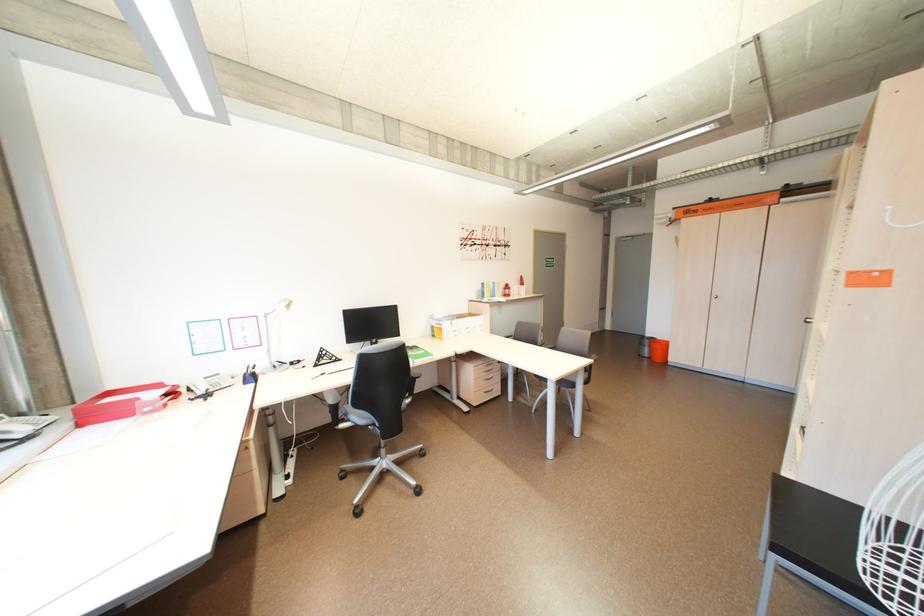
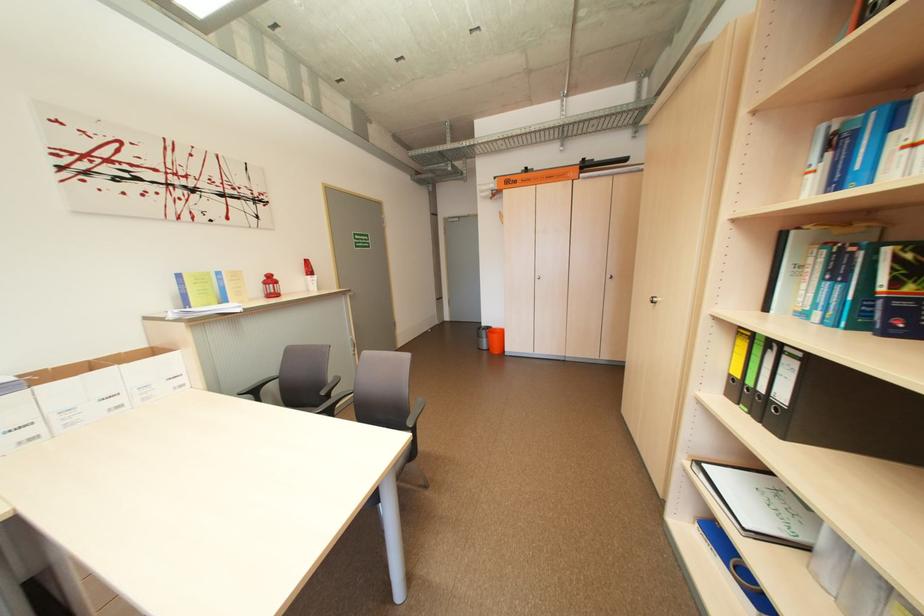
Find the pixel in the second image that matches (655,355) in the first image.

(494, 347)